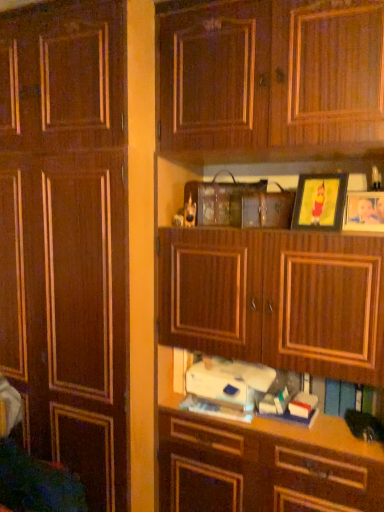
I want to click on matte gold picture frame at upper right, placed as the first picture frame when sorted from left to right, so click(320, 202).

Find the location of a particular element. The height and width of the screenshot is (512, 384). wooden photo frame at upper right, the 2th picture frame when ordered from left to right is located at coordinates (364, 212).

Image resolution: width=384 pixels, height=512 pixels. Describe the element at coordinates (67, 236) in the screenshot. I see `wooden cabinet at center` at that location.

What are the coordinates of `matte gold picture frame at upper right, placed as the first picture frame when sorted from left to right` in the screenshot? It's located at (320, 202).

Are white fabric swivel chair at lower left and wooden cabinet at center making contact?

No, white fabric swivel chair at lower left is not with wooden cabinet at center.

Looking at this image, is white fabric swivel chair at lower left closer to camera compared to wooden cabinet at center?

Yes, it is in front of wooden cabinet at center.

Which of these two, white fabric swivel chair at lower left or wooden cabinet at center, is wider?

wooden cabinet at center is wider.

From the picture: Visually, is white fabric swivel chair at lower left positioned to the left or to the right of wooden cabinet at center?

white fabric swivel chair at lower left is to the left of wooden cabinet at center.

Locate an element on the screen. The image size is (384, 512). cabinetry on the left of white matte book at center is located at coordinates (67, 236).

Which object is more forward, white matte book at center or wooden cabinet at center?

Positioned in front is wooden cabinet at center.

Between white matte book at center and wooden cabinet at center, which one has less height?

With less height is white matte book at center.

From the image's perspective, does white matte book at center appear higher than wooden cabinet at center?

Incorrect, from the image's perspective, white matte book at center is lower than wooden cabinet at center.

Considering the sizes of objects white fabric swivel chair at lower left and matte gold picture frame at upper right, placed as the first picture frame when sorted from left to right, in the image provided, who is shorter, white fabric swivel chair at lower left or matte gold picture frame at upper right, placed as the first picture frame when sorted from left to right,?

With less height is matte gold picture frame at upper right, placed as the first picture frame when sorted from left to right.

Does white fabric swivel chair at lower left turn towards matte gold picture frame at upper right, which is the 2th picture frame in right-to-left order?

No, white fabric swivel chair at lower left is not facing towards matte gold picture frame at upper right, which is the 2th picture frame in right-to-left order.

From the image's perspective, is white fabric swivel chair at lower left above matte gold picture frame at upper right, which is the 2th picture frame in right-to-left order?

Actually, white fabric swivel chair at lower left appears below matte gold picture frame at upper right, which is the 2th picture frame in right-to-left order, in the image.

In the scene shown: How distant is white fabric swivel chair at lower left from matte gold picture frame at upper right, which is the 2th picture frame in right-to-left order?

white fabric swivel chair at lower left and matte gold picture frame at upper right, which is the 2th picture frame in right-to-left order, are 4.47 feet apart.

Based on the photo, is matte gold picture frame at upper right, placed as the first picture frame when sorted from left to right, wider or thinner than white matte book at center?

Considering their sizes, matte gold picture frame at upper right, placed as the first picture frame when sorted from left to right, looks slimmer than white matte book at center.

There is a white matte book at center. In order to click on the 2nd picture frame above it (from the image's perspective) in this screenshot , I will do tap(320, 202).

Looking at this image, from a real-world perspective, which is physically above, matte gold picture frame at upper right, placed as the first picture frame when sorted from left to right, or white matte book at center?

In real-world perspective, matte gold picture frame at upper right, placed as the first picture frame when sorted from left to right, is above.

Which is closer, (311, 223) or (326, 393)?

Clearly, point (311, 223) is closer to the camera than point (326, 393).

From a real-world perspective, which is physically below, matte gold picture frame at upper right, placed as the first picture frame when sorted from left to right, or wooden cabinet at center?

In real-world perspective, wooden cabinet at center is lower.

Is wooden cabinet at center a part of matte gold picture frame at upper right, which is the 2th picture frame in right-to-left order?

No.

Does matte gold picture frame at upper right, which is the 2th picture frame in right-to-left order, have a larger size compared to wooden cabinet at center?

Incorrect, matte gold picture frame at upper right, which is the 2th picture frame in right-to-left order, is not larger than wooden cabinet at center.

Which object is positioned more to the right, wooden photo frame at upper right, the first picture frame when ordered from right to left, or white matte book at center?

wooden photo frame at upper right, the first picture frame when ordered from right to left.

How different are the orientations of wooden photo frame at upper right, the first picture frame when ordered from right to left, and white matte book at center in degrees?

4.58 degrees.

Which object is wider, wooden photo frame at upper right, the 2th picture frame when ordered from left to right, or white matte book at center?

Wider between the two is white matte book at center.

In the scene shown: From a real-world perspective, who is located lower, wooden photo frame at upper right, the 2th picture frame when ordered from left to right, or white fabric swivel chair at lower left?

From a 3D spatial view, white fabric swivel chair at lower left is below.

Can we say wooden photo frame at upper right, the 2th picture frame when ordered from left to right, lies outside white fabric swivel chair at lower left?

wooden photo frame at upper right, the 2th picture frame when ordered from left to right, is positioned outside white fabric swivel chair at lower left.

The height and width of the screenshot is (512, 384). Find the location of `swivel chair located on the left of wooden photo frame at upper right, the first picture frame when ordered from right to left`. swivel chair located on the left of wooden photo frame at upper right, the first picture frame when ordered from right to left is located at coordinates (31, 469).

Is wooden photo frame at upper right, the first picture frame when ordered from right to left, bigger than white fabric swivel chair at lower left?

No.

Locate an element on the screen. The width and height of the screenshot is (384, 512). cabinetry on the right of white fabric swivel chair at lower left is located at coordinates (67, 236).

Identify the location of cabinetry in front of the white matte book at center. This screenshot has width=384, height=512. (67, 236).

Looking at the image, which one is located further to wooden photo frame at upper right, the 2th picture frame when ordered from left to right, white fabric swivel chair at lower left or wooden cabinet at center?

Among the two, white fabric swivel chair at lower left is located further to wooden photo frame at upper right, the 2th picture frame when ordered from left to right.

From the image, which object appears to be nearer to matte gold picture frame at upper right, placed as the first picture frame when sorted from left to right, wooden cabinet at center or wooden photo frame at upper right, the first picture frame when ordered from right to left?

wooden photo frame at upper right, the first picture frame when ordered from right to left.

Based on their spatial positions, is wooden photo frame at upper right, the 2th picture frame when ordered from left to right, or white matte book at center closer to matte gold picture frame at upper right, placed as the first picture frame when sorted from left to right?

Among the two, wooden photo frame at upper right, the 2th picture frame when ordered from left to right, is located nearer to matte gold picture frame at upper right, placed as the first picture frame when sorted from left to right.

Estimate the real-world distances between objects in this image. Which object is further from matte gold picture frame at upper right, placed as the first picture frame when sorted from left to right, white fabric swivel chair at lower left or wooden photo frame at upper right, the first picture frame when ordered from right to left?

white fabric swivel chair at lower left lies further to matte gold picture frame at upper right, placed as the first picture frame when sorted from left to right, than the other object.

From the image, which object appears to be farther from wooden cabinet at center, wooden photo frame at upper right, the 2th picture frame when ordered from left to right, or white matte book at center?

Based on the image, wooden photo frame at upper right, the 2th picture frame when ordered from left to right, appears to be further to wooden cabinet at center.

Based on their spatial positions, is white matte book at center or white fabric swivel chair at lower left further from matte gold picture frame at upper right, which is the 2th picture frame in right-to-left order?

white fabric swivel chair at lower left is positioned further to the anchor matte gold picture frame at upper right, which is the 2th picture frame in right-to-left order.

When comparing their distances from white fabric swivel chair at lower left, does matte gold picture frame at upper right, which is the 2th picture frame in right-to-left order, or white matte book at center seem closer?

white matte book at center lies closer to white fabric swivel chair at lower left than the other object.

Considering their positions, is wooden photo frame at upper right, the 2th picture frame when ordered from left to right, positioned closer to wooden cabinet at center than white fabric swivel chair at lower left?

white fabric swivel chair at lower left.

Locate an element on the screen. This screenshot has height=512, width=384. cabinetry between white fabric swivel chair at lower left and wooden photo frame at upper right, the 2th picture frame when ordered from left to right, from left to right is located at coordinates (67, 236).

At what (x,y) coordinates should I click in order to perform the action: click on book located between wooden cabinet at center and matte gold picture frame at upper right, placed as the first picture frame when sorted from left to right, in the left-right direction. Please return your answer as a coordinate pair (x, y). This screenshot has width=384, height=512. Looking at the image, I should click on (241, 385).

You are a GUI agent. You are given a task and a screenshot of the screen. Output one action in this format:
    pyautogui.click(x=<x>, y=<y>)
    Task: Click on the picture frame between white fabric swivel chair at lower left and wooden photo frame at upper right, the 2th picture frame when ordered from left to right
    
    Given the screenshot: What is the action you would take?
    pyautogui.click(x=320, y=202)

Where is `book between white fabric swivel chair at lower left and wooden photo frame at upper right, the first picture frame when ordered from right to left`? book between white fabric swivel chair at lower left and wooden photo frame at upper right, the first picture frame when ordered from right to left is located at coordinates (241, 385).